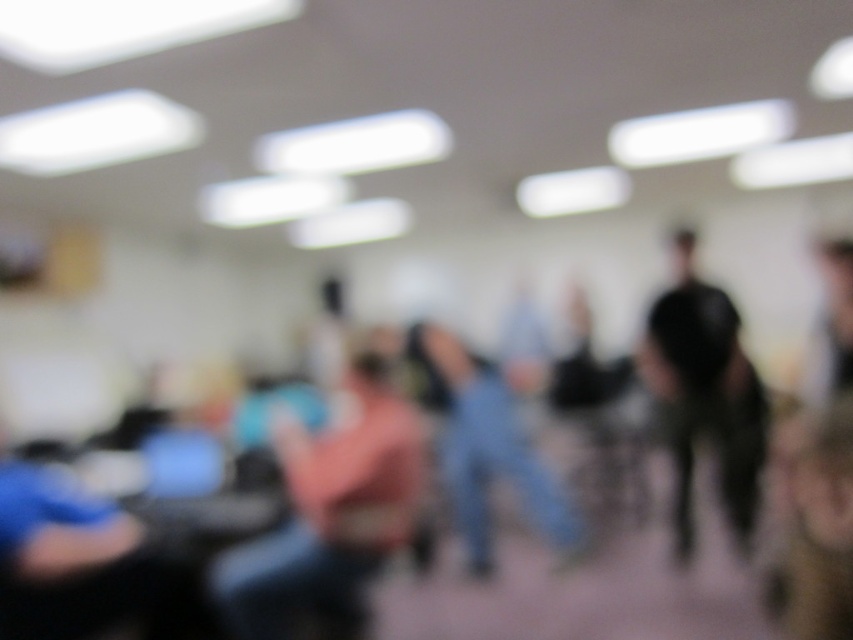
Question: Which point is closer to the camera?

Choices:
 (A) denim jeans at center
 (B) blue fabric shirt at lower left
 (C) pink fabric shirt at center

Answer: (B)

Question: Estimate the real-world distances between objects in this image. Which object is closer to the brown leather jacket at lower right?

Choices:
 (A) blue fabric shirt at lower left
 (B) denim jeans at center
 (C) pink fabric shirt at center

Answer: (C)

Question: Can you confirm if pink fabric shirt at center is thinner than brown leather jacket at lower right?

Choices:
 (A) no
 (B) yes

Answer: (A)

Question: Can you confirm if blue fabric shirt at lower left is bigger than dark gray fabric jacket at right?

Choices:
 (A) yes
 (B) no

Answer: (B)

Question: Which object is closer to the camera taking this photo?

Choices:
 (A) brown leather jacket at lower right
 (B) blue fabric shirt at lower left
 (C) pink fabric shirt at center

Answer: (A)

Question: Is pink fabric shirt at center to the right of dark gray fabric jacket at right from the viewer's perspective?

Choices:
 (A) no
 (B) yes

Answer: (A)